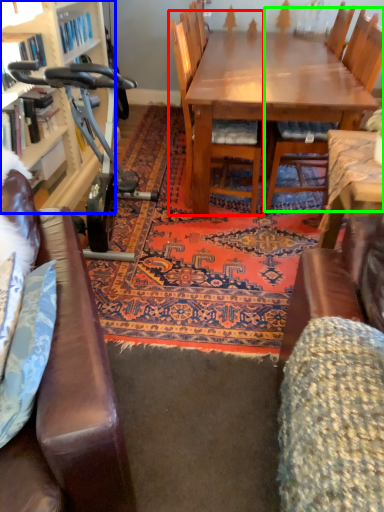
Question: Which is nearer to the chair (highlighted by a red box)? bookcase (highlighted by a blue box) or chair (highlighted by a green box).

Choices:
 (A) bookcase
 (B) chair

Answer: (B)